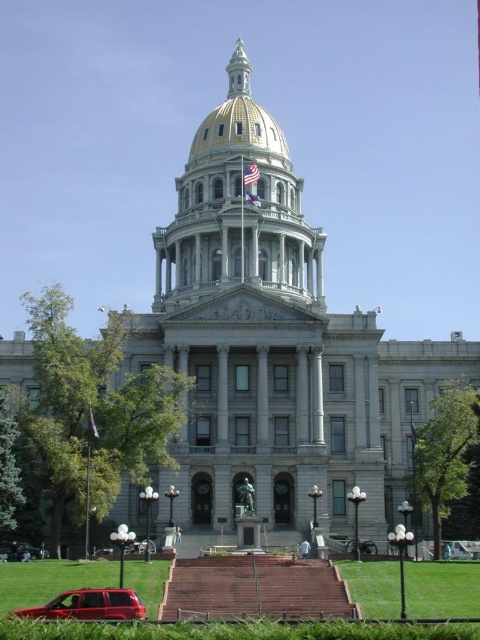
What object is located at the coordinates point (22, 550) in the image?

The point (22, 550) corresponds to the matte red suv at lower left.

You are a photographer standing in front of the grand neoclassical building. You want to capture a photo that includes both the metallic silver car at lower right and the silky fabric flag at center. Based on their positions, will the car appear smaller in the photo compared to the flag?

The metallic silver car at lower right is located below the silky fabric flag at center. Since the car is lower in the frame, it might appear smaller due to perspective, but without knowing their actual sizes or distances, we can only confirm their positional relationship.